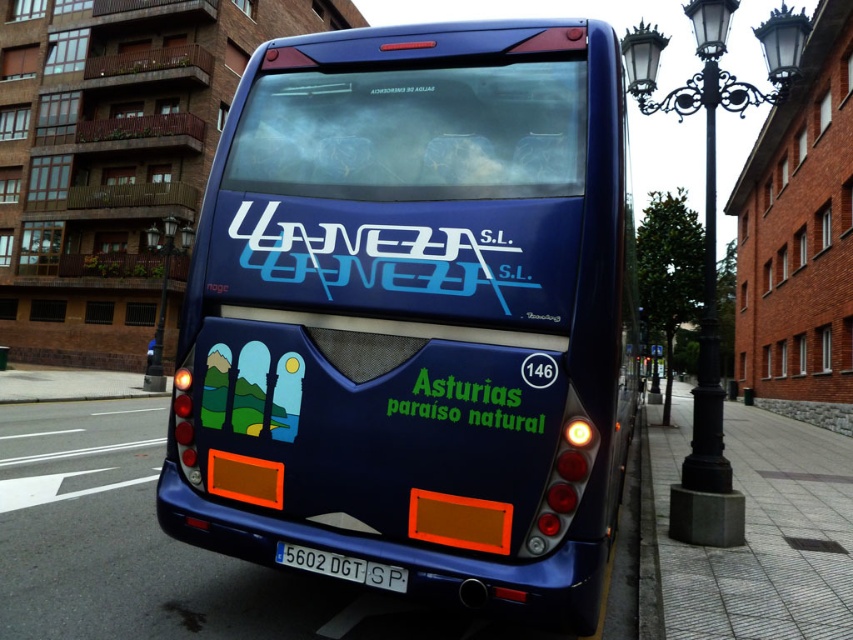
You are a GUI agent. You are given a task and a screenshot of the screen. Output one action in this format:
    pyautogui.click(x=<x>, y=<y>)
    Task: Click on the glossy blue bus at center
    
    Given the screenshot: What is the action you would take?
    pyautogui.click(x=415, y=310)

Is glossy blue bus at center positioned in front of black wrought iron streetlight at right?

Yes, it is.

Between point (357, 177) and point (723, 525), which one is positioned in front?

Point (357, 177)

Find the location of `glossy blue bus at center`. glossy blue bus at center is located at coordinates (415, 310).

Can you confirm if black wrought iron streetlight at right is positioned to the right of blue plastic license plate at lower center?

Yes, black wrought iron streetlight at right is to the right of blue plastic license plate at lower center.

At what (x,y) coordinates should I click in order to perform the action: click on black wrought iron streetlight at right. Please return your answer as a coordinate pair (x, y). The image size is (853, 640). Looking at the image, I should click on (711, 240).

Identify the location of black wrought iron streetlight at right. The height and width of the screenshot is (640, 853). (711, 240).